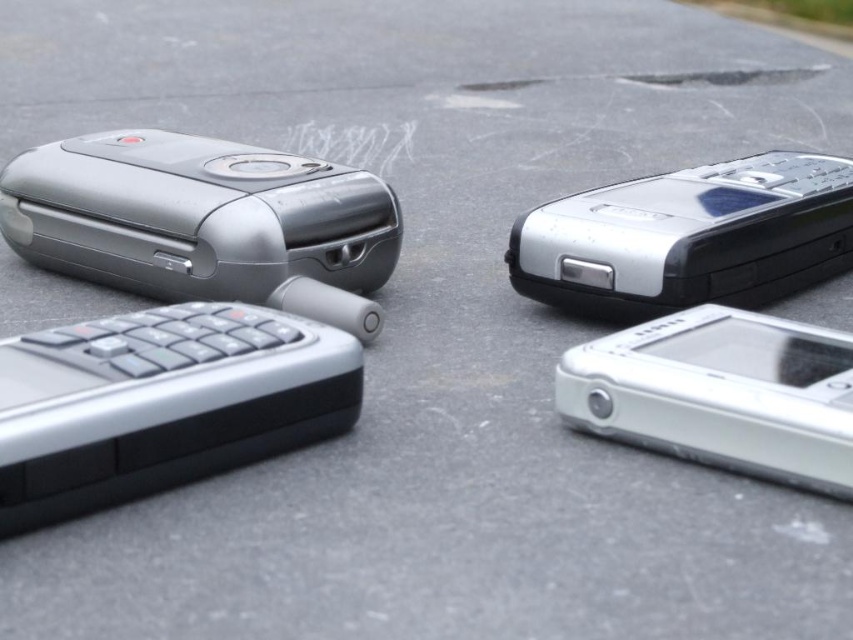
Is satin silver flip phone at upper left shorter than satin silver phone at upper right?

No, satin silver flip phone at upper left is not shorter than satin silver phone at upper right.

Is satin silver flip phone at upper left behind satin silver phone at upper right?

Yes, it is.

Is point (6, 200) positioned after point (692, 200)?

Yes, it is.

I want to click on satin silver flip phone at upper left, so click(x=196, y=216).

Who is lower down, satin silver flip phone at upper left or sleek silver phone at lower right?

sleek silver phone at lower right is lower down.

Does satin silver flip phone at upper left have a greater width compared to sleek silver phone at lower right?

Indeed, satin silver flip phone at upper left has a greater width compared to sleek silver phone at lower right.

Does point (212, 232) come behind point (674, 362)?

Yes.

The image size is (853, 640). I want to click on satin silver flip phone at upper left, so click(196, 216).

Can you confirm if satin silver phone at upper right is thinner than sleek silver phone at lower right?

In fact, satin silver phone at upper right might be wider than sleek silver phone at lower right.

Between satin silver phone at upper right and sleek silver phone at lower right, which one has more height?

With more height is satin silver phone at upper right.

The width and height of the screenshot is (853, 640). What are the coordinates of `satin silver phone at upper right` in the screenshot? It's located at (689, 236).